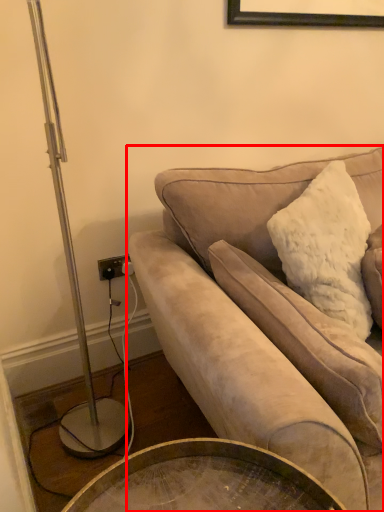
Question: In this image, where is studio couch (annotated by the red box) located relative to pillow?

Choices:
 (A) left
 (B) right

Answer: (B)